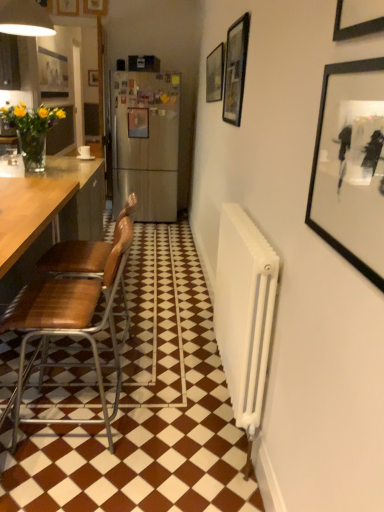
Measure the distance between point (379, 127) and camera.

Point (379, 127) is 34.25 inches from camera.

What do you see at coordinates (84, 252) in the screenshot?
I see `brown leather chair at left, positioned as the 1th chair in back-to-front order` at bounding box center [84, 252].

What is the approximate height of matte black picture frame at upper center, acting as the fourth picture frame starting from the left?

matte black picture frame at upper center, acting as the fourth picture frame starting from the left, is 15.61 inches tall.

This screenshot has width=384, height=512. What do you see at coordinates (215, 74) in the screenshot?
I see `matte black picture frame at upper center, acting as the 3th picture frame starting from the front` at bounding box center [215, 74].

What do you see at coordinates (68, 7) in the screenshot?
I see `wooden picture frame at upper center, placed as the 5th picture frame when sorted from front to back` at bounding box center [68, 7].

Identify the location of matte black picture frame at upper center, arranged as the fifth picture frame when viewed from the right. The image size is (384, 512). (95, 7).

The image size is (384, 512). In order to click on black matte picture frame at upper right, the first picture frame in the right-to-left sequence in this screenshot , I will do `click(351, 166)`.

Based on the photo, from a real-world perspective, is brown leather chair at left, which is the second chair in back-to-front order, physically located above or below brown leather chair at left, positioned as the 1th chair in back-to-front order?

Clearly, from a real-world perspective, brown leather chair at left, which is the second chair in back-to-front order, is below brown leather chair at left, positioned as the 1th chair in back-to-front order.

At what (x,y) coordinates should I click in order to perform the action: click on chair to the left of brown leather chair at left, which is the second chair in back-to-front order. Please return your answer as a coordinate pair (x, y). The image size is (384, 512). Looking at the image, I should click on (84, 252).

Is brown leather chair at left, placed as the 1th chair when sorted from front to back, inside the boundaries of brown leather chair at left, positioned as the 1th chair in back-to-front order, or outside?

brown leather chair at left, placed as the 1th chair when sorted from front to back, cannot be found inside brown leather chair at left, positioned as the 1th chair in back-to-front order.

Between brown leather chair at left, which is the second chair in back-to-front order, and brown leather chair at left, positioned as the 1th chair in back-to-front order, which one appears on the left side from the viewer's perspective?

brown leather chair at left, positioned as the 1th chair in back-to-front order.

Can you confirm if wooden picture frame at upper center, positioned as the 6th picture frame in right-to-left order, is taller than black glass picture frame at upper center, positioned as the 2th picture frame in right-to-left order?

No, wooden picture frame at upper center, positioned as the 6th picture frame in right-to-left order, is not taller than black glass picture frame at upper center, positioned as the 2th picture frame in right-to-left order.

From the image's perspective, which object appears higher, wooden picture frame at upper center, placed as the 5th picture frame when sorted from front to back, or black glass picture frame at upper center, positioned as the 2th picture frame in right-to-left order?

wooden picture frame at upper center, placed as the 5th picture frame when sorted from front to back.

Is wooden picture frame at upper center, the sixth picture frame in the bottom-to-top sequence, closer to camera compared to black glass picture frame at upper center, the second picture frame in the front-to-back sequence?

That is False.

Can you confirm if metallic silver picture frame at center, the 3th picture frame from the back, is bigger than white glossy tile at center?

No, metallic silver picture frame at center, the 3th picture frame from the back, is not bigger than white glossy tile at center.

Where is `tile in front of the metallic silver picture frame at center, marked as the 3th picture frame in a top-to-bottom arrangement`? tile in front of the metallic silver picture frame at center, marked as the 3th picture frame in a top-to-bottom arrangement is located at coordinates click(146, 408).

Considering the sizes of objects metallic silver picture frame at center, placed as the 4th picture frame when sorted from right to left, and white glossy tile at center in the image provided, who is shorter, metallic silver picture frame at center, placed as the 4th picture frame when sorted from right to left, or white glossy tile at center?

white glossy tile at center is shorter.

From a real-world perspective, is metallic silver picture frame at center, which is the 3th picture frame from left to right, above or below white glossy tile at center?

In terms of real-world spatial position, metallic silver picture frame at center, which is the 3th picture frame from left to right, is above white glossy tile at center.

From a real-world perspective, between metallic silver picture frame at center, the 3th picture frame from the back, and wooden picture frame at upper center, the sixth picture frame in the bottom-to-top sequence, who is vertically higher?

From a 3D spatial view, wooden picture frame at upper center, the sixth picture frame in the bottom-to-top sequence, is above.

What's the angular difference between metallic silver picture frame at center, which ranks as the 4th picture frame in front-to-back order, and wooden picture frame at upper center, the first picture frame positioned from the top,'s facing directions?

The facing directions of metallic silver picture frame at center, which ranks as the 4th picture frame in front-to-back order, and wooden picture frame at upper center, the first picture frame positioned from the top, are 3.24 degrees apart.

Is metallic silver picture frame at center, placed as the 4th picture frame when sorted from right to left, taller than wooden picture frame at upper center, placed as the 1th picture frame when sorted from left to right?

Correct, metallic silver picture frame at center, placed as the 4th picture frame when sorted from right to left, is much taller as wooden picture frame at upper center, placed as the 1th picture frame when sorted from left to right.

Which is more to the right, metallic silver picture frame at center, the fourth picture frame from the bottom, or wooden picture frame at upper center, the first picture frame positioned from the top?

metallic silver picture frame at center, the fourth picture frame from the bottom.

Considering the sizes of objects brown leather chair at left, placed as the 1th chair when sorted from front to back, and matte black picture frame at upper center, acting as the second picture frame starting from the top, in the image provided, who is taller, brown leather chair at left, placed as the 1th chair when sorted from front to back, or matte black picture frame at upper center, acting as the second picture frame starting from the top,?

brown leather chair at left, placed as the 1th chair when sorted from front to back, is taller.

Is brown leather chair at left, which is the second chair in back-to-front order, located outside matte black picture frame at upper center, acting as the second picture frame starting from the top?

Yes, brown leather chair at left, which is the second chair in back-to-front order, is located beyond the bounds of matte black picture frame at upper center, acting as the second picture frame starting from the top.

Who is smaller, brown leather chair at left, which is the second chair in back-to-front order, or matte black picture frame at upper center, arranged as the fifth picture frame when viewed from the right?

Smaller between the two is matte black picture frame at upper center, arranged as the fifth picture frame when viewed from the right.

Is wooden picture frame at upper center, placed as the 1th picture frame when sorted from left to right, to the left or to the right of white glossy tile at center in the image?

In the image, wooden picture frame at upper center, placed as the 1th picture frame when sorted from left to right, appears on the left side of white glossy tile at center.

Is point (61, 11) farther from camera compared to point (178, 485)?

Yes.

Considering the positions of objects wooden picture frame at upper center, placed as the 5th picture frame when sorted from front to back, and white glossy tile at center in the image provided, who is behind, wooden picture frame at upper center, placed as the 5th picture frame when sorted from front to back, or white glossy tile at center?

wooden picture frame at upper center, placed as the 5th picture frame when sorted from front to back, is further away from the camera.

Which picture frame is the 4th one when counting from the right side of the white glossy tile at center? Please provide its 2D coordinates.

[(351, 166)]

Between white glossy tile at center and black matte picture frame at upper right, which appears as the first picture frame when ordered from the bottom, which one has smaller width?

black matte picture frame at upper right, which appears as the first picture frame when ordered from the bottom.

From the image's perspective, is white glossy tile at center located above black matte picture frame at upper right, which appears as the first picture frame when ordered from the bottom?

Actually, white glossy tile at center appears below black matte picture frame at upper right, which appears as the first picture frame when ordered from the bottom, in the image.

From a real-world perspective, which object rests below the other?

white glossy tile at center, from a real-world perspective.

Identify the location of chair lying on the left of brown leather chair at left, placed as the 1th chair when sorted from front to back. Image resolution: width=384 pixels, height=512 pixels. [x=84, y=252].

From a real-world perspective, which picture frame is the 3rd one underneath the wooden picture frame at upper center, placed as the 5th picture frame when sorted from front to back? Please provide its 2D coordinates.

[(235, 69)]

When comparing their distances from brown leather chair at left, positioned as the 1th chair in back-to-front order, does wooden picture frame at upper center, positioned as the 6th picture frame in right-to-left order, or metallic silver picture frame at center, which ranks as the 4th picture frame in front-to-back order, seem closer?

Among the two, metallic silver picture frame at center, which ranks as the 4th picture frame in front-to-back order, is located nearer to brown leather chair at left, positioned as the 1th chair in back-to-front order.

Which object lies further to the anchor point matte black picture frame at upper center, marked as the fifth picture frame in a bottom-to-top arrangement, matte black picture frame at upper center, placed as the fourth picture frame when sorted from top to bottom, or black matte picture frame at upper right, the sixth picture frame viewed from the back?

black matte picture frame at upper right, the sixth picture frame viewed from the back, lies further to matte black picture frame at upper center, marked as the fifth picture frame in a bottom-to-top arrangement, than the other object.

Considering their positions, is metallic silver picture frame at center, the fourth picture frame from the bottom, positioned closer to matte black picture frame at upper center, placed as the fourth picture frame when sorted from top to bottom, than black glass picture frame at upper center, the second picture frame in the front-to-back sequence?

Based on the image, black glass picture frame at upper center, the second picture frame in the front-to-back sequence, appears to be nearer to matte black picture frame at upper center, placed as the fourth picture frame when sorted from top to bottom.

When comparing their distances from brown leather chair at left, which is the second chair in back-to-front order, does black glass picture frame at upper center, which is counted as the 5th picture frame, starting from the back, or black matte picture frame at upper right, placed as the sixth picture frame when sorted from left to right, seem closer?

Among the two, black matte picture frame at upper right, placed as the sixth picture frame when sorted from left to right, is located nearer to brown leather chair at left, which is the second chair in back-to-front order.

From the image, which object appears to be nearer to wooden picture frame at upper center, positioned as the 6th picture frame in right-to-left order, metallic silver picture frame at center, marked as the 3th picture frame in a top-to-bottom arrangement, or black glass picture frame at upper center, the second picture frame in the front-to-back sequence?

Based on the image, metallic silver picture frame at center, marked as the 3th picture frame in a top-to-bottom arrangement, appears to be nearer to wooden picture frame at upper center, positioned as the 6th picture frame in right-to-left order.

Which object lies further to the anchor point black glass picture frame at upper center, the second picture frame in the front-to-back sequence, wooden picture frame at upper center, marked as the 2th picture frame in a back-to-front arrangement, or metallic silver picture frame at center, which is the 3th picture frame from left to right?

wooden picture frame at upper center, marked as the 2th picture frame in a back-to-front arrangement, lies further to black glass picture frame at upper center, the second picture frame in the front-to-back sequence, than the other object.

When comparing their distances from black matte picture frame at upper right, the first picture frame in the right-to-left sequence, does black glass picture frame at upper center, the second picture frame in the front-to-back sequence, or wooden picture frame at upper center, the sixth picture frame in the bottom-to-top sequence, seem further?

wooden picture frame at upper center, the sixth picture frame in the bottom-to-top sequence, lies further to black matte picture frame at upper right, the first picture frame in the right-to-left sequence, than the other object.

Estimate the real-world distances between objects in this image. Which object is further from white ribbed radiator at right, wooden picture frame at upper center, placed as the 5th picture frame when sorted from front to back, or metallic silver picture frame at center, the 3th picture frame from the back?

Among the two, wooden picture frame at upper center, placed as the 5th picture frame when sorted from front to back, is located further to white ribbed radiator at right.

Locate an element on the screen. The image size is (384, 512). chair that lies between black glass picture frame at upper center, which is counted as the 5th picture frame, starting from the back, and brown leather chair at left, which is the second chair in back-to-front order, from top to bottom is located at coordinates (84, 252).

What are the coordinates of `radiator positioned between black matte picture frame at upper right, which appears as the first picture frame when ordered from the bottom, and wooden picture frame at upper center, placed as the 5th picture frame when sorted from front to back, from near to far` in the screenshot? It's located at (244, 314).

Image resolution: width=384 pixels, height=512 pixels. In order to click on chair between white glossy tile at center and matte black picture frame at upper center, the 6th picture frame from the front, from front to back in this screenshot , I will do `click(84, 252)`.

Find the location of `chair between brown leather chair at left, which is the second chair in back-to-front order, and matte black picture frame at upper center, acting as the second picture frame starting from the top, from front to back`. chair between brown leather chair at left, which is the second chair in back-to-front order, and matte black picture frame at upper center, acting as the second picture frame starting from the top, from front to back is located at coordinates point(84,252).